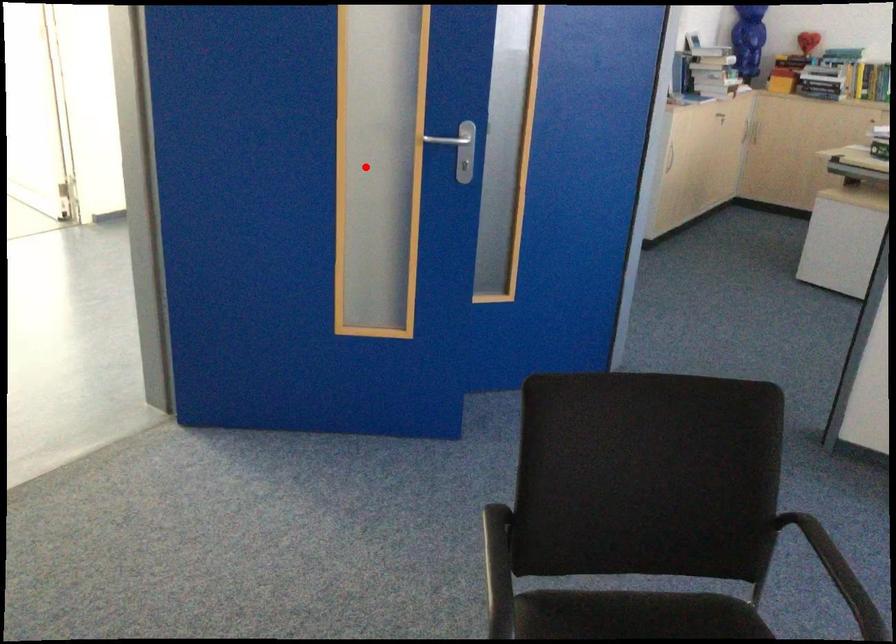
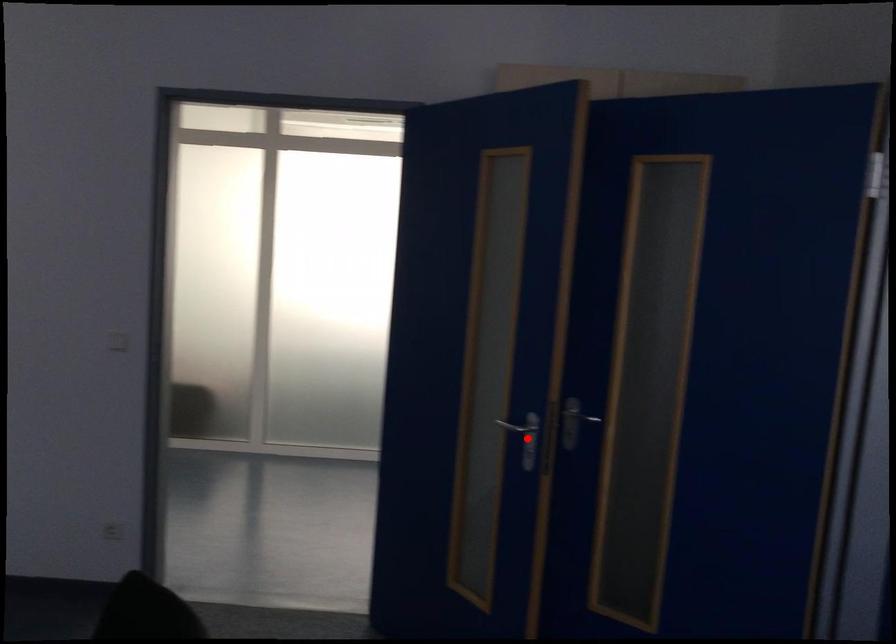
I am providing you with two images of the same scene from different viewpoints. A red point is marked on the first image and another point is marked on the second image. Is the red point in image1 aligned with the point shown in image2?

Yes